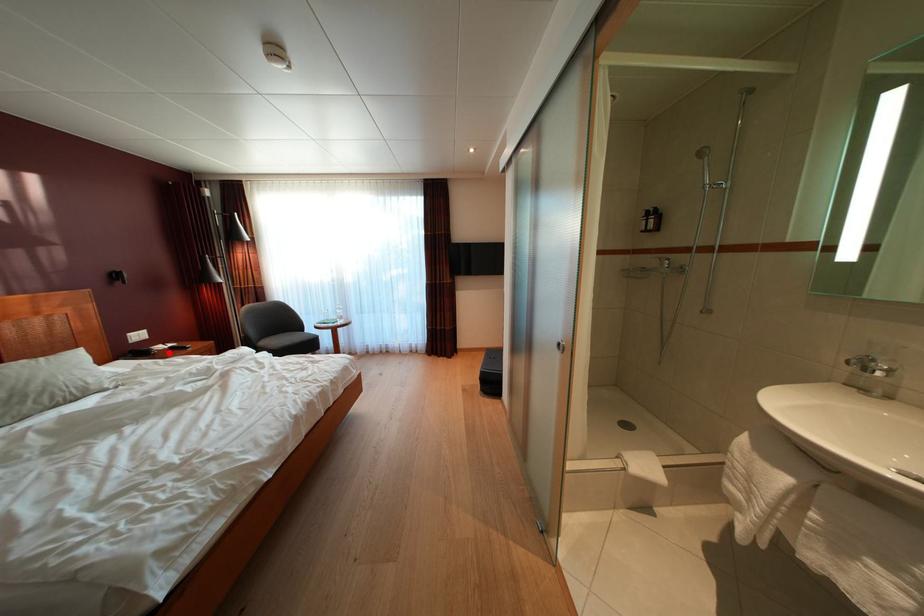
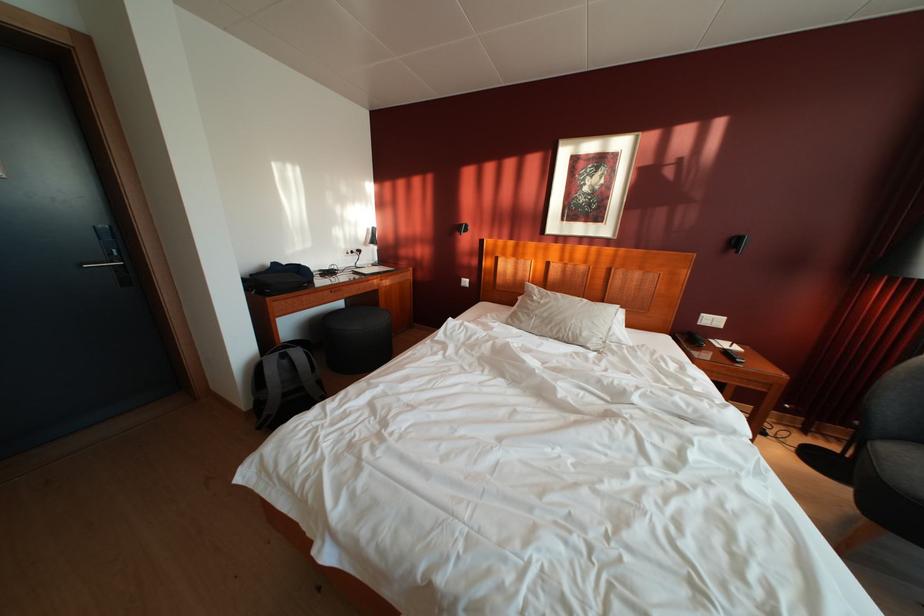
In the second image, find the point that corresponds to the highlighted location in the first image.

(732, 350)